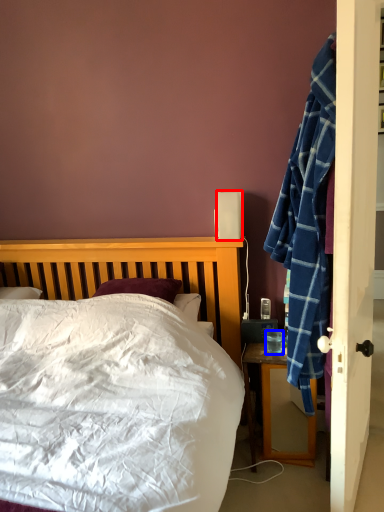
Question: Which object appears farthest to the camera in this image, loudspeaker (highlighted by a red box) or coffee cup (highlighted by a blue box)?

Choices:
 (A) loudspeaker
 (B) coffee cup

Answer: (A)